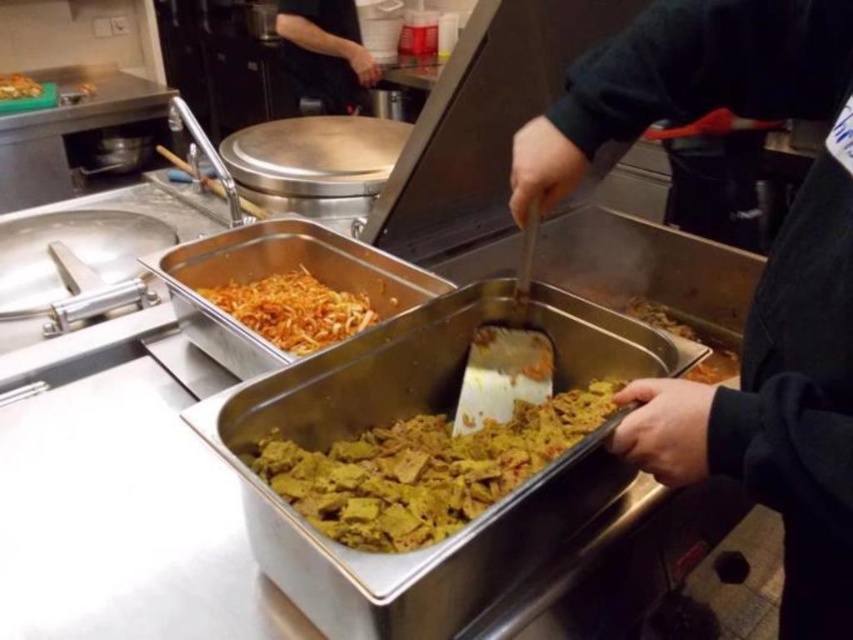
Does point (368, 486) come farther from viewer compared to point (36, 88)?

No, (368, 486) is closer to viewer.

This screenshot has width=853, height=640. Find the location of `yellowish matte rectangular food at center`. yellowish matte rectangular food at center is located at coordinates (424, 468).

Does yellowish matte rectangular food at center have a larger size compared to yellowish matte shredded vegetables at center?

Yes, yellowish matte rectangular food at center is bigger than yellowish matte shredded vegetables at center.

Between point (315, 502) and point (318, 333), which one is positioned in front?

Positioned in front is point (315, 502).

What are the coordinates of `yellowish matte rectangular food at center` in the screenshot? It's located at (424, 468).

Who is taller, yellowish matte shredded vegetables at center or shiny orange shredded vegetables at upper left?

With more height is shiny orange shredded vegetables at upper left.

Which is in front, point (245, 301) or point (9, 90)?

Point (245, 301) is more forward.

Locate an element on the screen. The width and height of the screenshot is (853, 640). yellowish matte shredded vegetables at center is located at coordinates (293, 308).